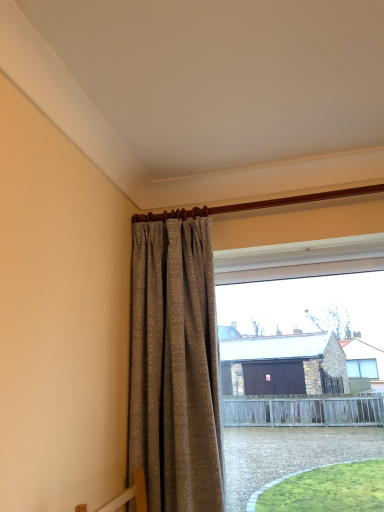
The height and width of the screenshot is (512, 384). I want to click on beige textured curtain at center, so click(175, 368).

The image size is (384, 512). What do you see at coordinates (175, 368) in the screenshot? I see `beige textured curtain at center` at bounding box center [175, 368].

In order to face transparent glass window at center, should I rotate leftwards or rightwards?

A 15.097 degree turn to the right will do.

The width and height of the screenshot is (384, 512). Describe the element at coordinates (301, 350) in the screenshot. I see `transparent glass window at center` at that location.

What is the approximate height of transparent glass window at center?

It is 99.44 centimeters.

The width and height of the screenshot is (384, 512). Find the location of `transparent glass window at center`. transparent glass window at center is located at coordinates (301, 350).

Locate an element on the screen. This screenshot has width=384, height=512. beige textured curtain at center is located at coordinates (175, 368).

Which object is positioned more to the right, transparent glass window at center or beige textured curtain at center?

transparent glass window at center is more to the right.

Relative to beige textured curtain at center, is transparent glass window at center in front or behind?

Clearly, transparent glass window at center is behind beige textured curtain at center.

Is point (238, 425) more distant than point (170, 366)?

Yes, point (238, 425) is farther from viewer.

From the image's perspective, is transparent glass window at center above or below beige textured curtain at center?

transparent glass window at center is below beige textured curtain at center.

From a real-world perspective, which is physically above, transparent glass window at center or beige textured curtain at center?

beige textured curtain at center is physically above.

Can you confirm if transparent glass window at center is wider than beige textured curtain at center?

No.

Considering the sizes of transparent glass window at center and beige textured curtain at center in the image, is transparent glass window at center taller or shorter than beige textured curtain at center?

transparent glass window at center is shorter than beige textured curtain at center.

In terms of size, does transparent glass window at center appear bigger or smaller than beige textured curtain at center?

In the image, transparent glass window at center appears to be larger than beige textured curtain at center.

Based on the photo, can beige textured curtain at center be found inside transparent glass window at center?

No, beige textured curtain at center is located outside of transparent glass window at center.

Is transparent glass window at center not near beige textured curtain at center?

They are positioned close to each other.

Is transparent glass window at center oriented away from beige textured curtain at center?

No, transparent glass window at center is not facing the opposite direction of beige textured curtain at center.

How different are the orientations of transparent glass window at center and beige textured curtain at center in degrees?

The angle between the facing direction of transparent glass window at center and the facing direction of beige textured curtain at center is 2.83 degrees.

How distant is transparent glass window at center from beige textured curtain at center?

The distance of transparent glass window at center from beige textured curtain at center is 16.43 inches.

Where is `curtain located above the transparent glass window at center (from the image's perspective)`? curtain located above the transparent glass window at center (from the image's perspective) is located at coordinates (175, 368).

Which object is positioned more to the left, beige textured curtain at center or transparent glass window at center?

beige textured curtain at center.

Relative to transparent glass window at center, is beige textured curtain at center in front or behind?

Clearly, beige textured curtain at center is in front of transparent glass window at center.

Which is behind, point (175, 448) or point (256, 465)?

The point (256, 465) is behind.

From the image's perspective, would you say beige textured curtain at center is shown under transparent glass window at center?

Actually, beige textured curtain at center appears above transparent glass window at center in the image.

From a real-world perspective, who is located lower, beige textured curtain at center or transparent glass window at center?

transparent glass window at center, from a real-world perspective.

Based on the photo, considering the relative sizes of beige textured curtain at center and transparent glass window at center in the image provided, is beige textured curtain at center wider than transparent glass window at center?

Yes, beige textured curtain at center is wider than transparent glass window at center.

Is beige textured curtain at center taller than transparent glass window at center?

Indeed, beige textured curtain at center has a greater height compared to transparent glass window at center.

Is beige textured curtain at center bigger or smaller than transparent glass window at center?

beige textured curtain at center is smaller than transparent glass window at center.

Does beige textured curtain at center contain transparent glass window at center?

Definitely not — transparent glass window at center is not inside beige textured curtain at center.

Would you say beige textured curtain at center is a long distance from transparent glass window at center?

They are positioned close to each other.

Is beige textured curtain at center facing towards transparent glass window at center?

No.

I want to click on window lying behind the beige textured curtain at center, so click(x=301, y=350).

Locate an element on the screen. window directly beneath the beige textured curtain at center (from a real-world perspective) is located at coordinates (301, 350).

The width and height of the screenshot is (384, 512). I want to click on curtain above the transparent glass window at center (from the image's perspective), so click(x=175, y=368).